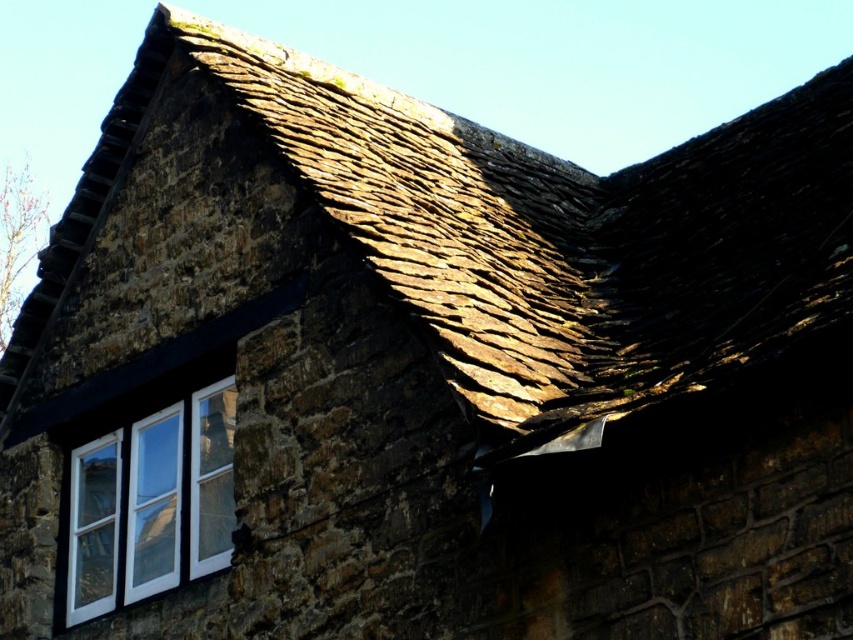
Question: Considering the relative positions of brown shingles at upper center and white wood window at lower left in the image provided, where is brown shingles at upper center located with respect to white wood window at lower left?

Choices:
 (A) above
 (B) below

Answer: (A)

Question: Which point is farther to the camera?

Choices:
 (A) (213, 428)
 (B) (439, 225)

Answer: (A)

Question: Among these objects, which one is farthest from the camera?

Choices:
 (A) white wood window at lower left
 (B) brown shingles at upper center

Answer: (A)

Question: Considering the relative positions of brown shingles at upper center and white wood window at lower left in the image provided, where is brown shingles at upper center located with respect to white wood window at lower left?

Choices:
 (A) below
 (B) above

Answer: (B)

Question: Is brown shingles at upper center smaller than white wood window at lower left?

Choices:
 (A) yes
 (B) no

Answer: (B)